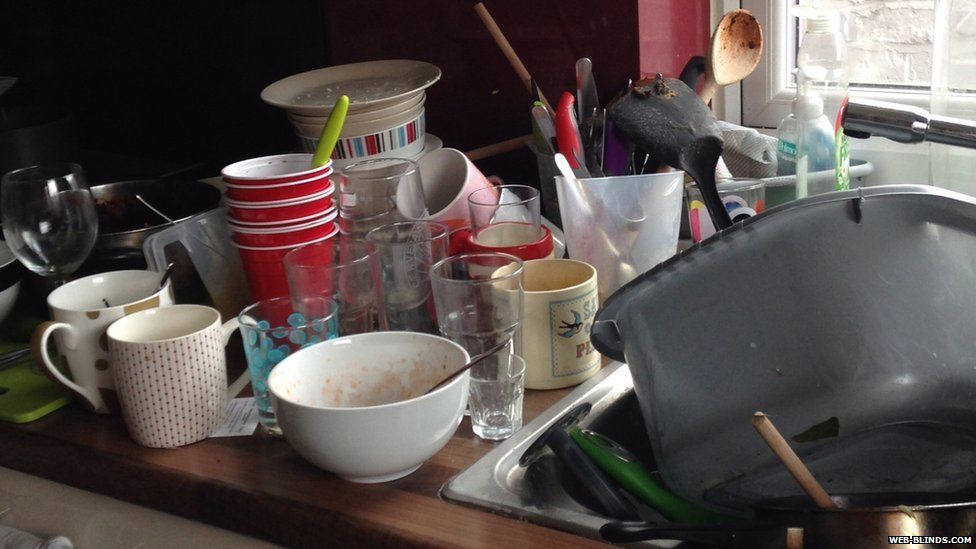
Locate an element on the screen. silverware is located at coordinates (167, 272), (478, 361), (584, 72), (603, 140), (541, 121).